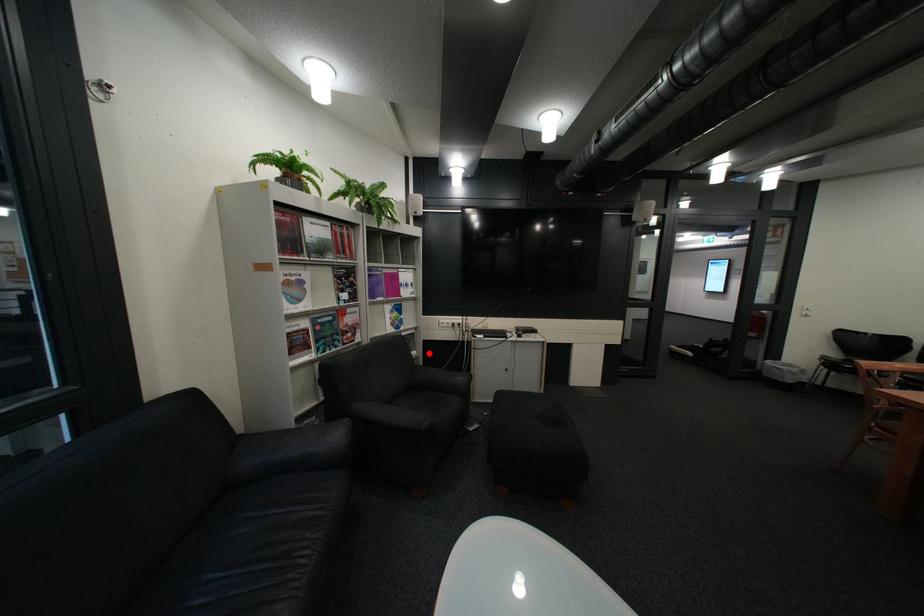
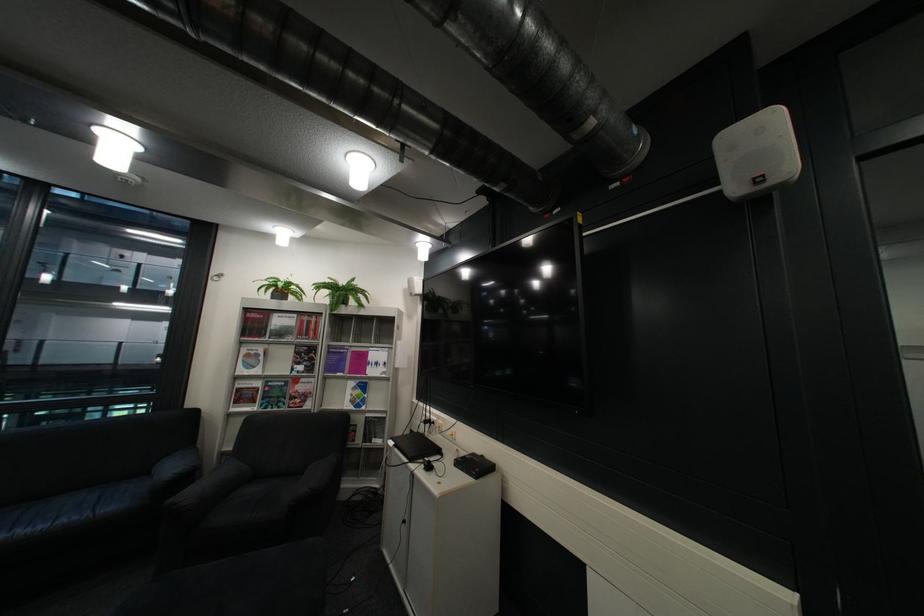
Where in the second image is the point corresponding to the highlighted location from the first image?

(393, 442)